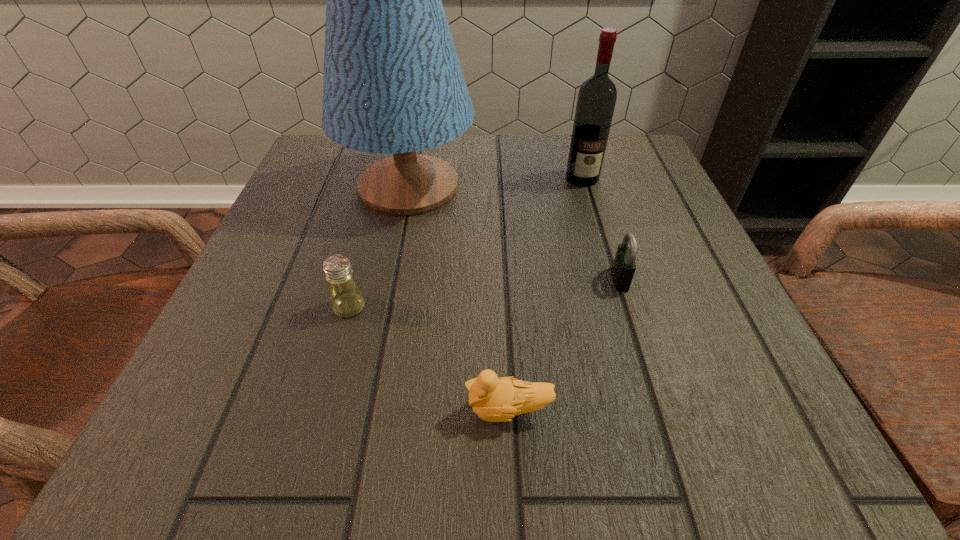
You are a GUI agent. You are given a task and a screenshot of the screen. Output one action in this format:
    pyautogui.click(x=<x>, y=<y>)
    Task: Click on the vacant point located between the duckling and the tallest object
    
    Given the screenshot: What is the action you would take?
    pyautogui.click(x=459, y=298)

I want to click on unoccupied position between the padlock and the alcohol, so click(x=601, y=228).

What are the coordinates of `vacant area that lies between the third nearest object and the nearest object` in the screenshot? It's located at (564, 345).

What are the coordinates of `empty space that is in between the saltshaker and the second tallest object` in the screenshot? It's located at (466, 242).

The width and height of the screenshot is (960, 540). Identify the location of empty space between the second tallest object and the fourth farthest object. (466, 242).

This screenshot has width=960, height=540. Find the location of `free space that is in between the fourth shortest object and the lampshade`. free space that is in between the fourth shortest object and the lampshade is located at coordinates (495, 182).

Where is `free spot between the fourth shortest object and the second nearest object`? The height and width of the screenshot is (540, 960). free spot between the fourth shortest object and the second nearest object is located at coordinates (466, 242).

I want to click on free space that is in between the tallest object and the third farthest object, so click(x=515, y=233).

Locate an element on the screen. This screenshot has width=960, height=540. vacant space that is in between the tallest object and the nearest object is located at coordinates (459, 298).

The height and width of the screenshot is (540, 960). What are the coordinates of `the closest object relative to the alcohol` in the screenshot? It's located at (393, 84).